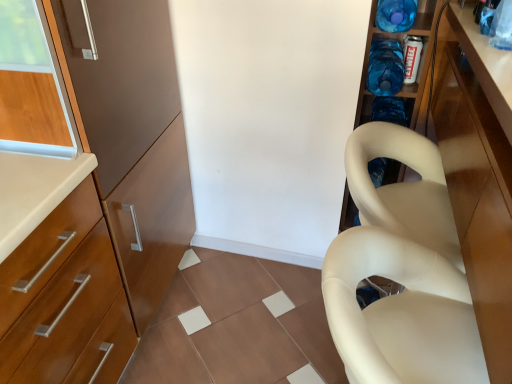
Question: Is the depth of beige matte plastic chair at right less than that of glossy wood cabinet at right?

Choices:
 (A) no
 (B) yes

Answer: (A)

Question: Is beige matte plastic chair at right behind glossy wood cabinet at right?

Choices:
 (A) yes
 (B) no

Answer: (A)

Question: Can you confirm if beige matte plastic chair at right is smaller than glossy wood cabinet at right?

Choices:
 (A) yes
 (B) no

Answer: (A)

Question: Could glossy wood cabinet at right be considered to be inside beige matte plastic chair at right?

Choices:
 (A) yes
 (B) no

Answer: (B)

Question: Is glossy wood cabinet at right at the back of beige matte plastic chair at right?

Choices:
 (A) no
 (B) yes

Answer: (A)

Question: Is beige matte plastic chair at right far away from glossy wood cabinet at right?

Choices:
 (A) yes
 (B) no

Answer: (B)

Question: Considering the relative sizes of blue plastic bottle at upper right, which ranks as the first bottle in bottom-to-top order, and blue translucent bottle at upper right, the second bottle ordered from the bottom, in the image provided, is blue plastic bottle at upper right, which ranks as the first bottle in bottom-to-top order, thinner than blue translucent bottle at upper right, the second bottle ordered from the bottom,?

Choices:
 (A) no
 (B) yes

Answer: (B)

Question: Could you tell me if blue plastic bottle at upper right, the 2th bottle positioned from the top, is turned towards blue translucent bottle at upper right, the second bottle ordered from the bottom?

Choices:
 (A) yes
 (B) no

Answer: (B)

Question: From a real-world perspective, does blue plastic bottle at upper right, the 2th bottle positioned from the top, sit lower than blue translucent bottle at upper right, which is counted as the 1th bottle, starting from the top?

Choices:
 (A) no
 (B) yes

Answer: (B)

Question: From a real-world perspective, is blue plastic bottle at upper right, which ranks as the first bottle in bottom-to-top order, on top of blue translucent bottle at upper right, the second bottle ordered from the bottom?

Choices:
 (A) yes
 (B) no

Answer: (B)

Question: From the image's perspective, is blue plastic bottle at upper right, which ranks as the first bottle in bottom-to-top order, on blue translucent bottle at upper right, the second bottle ordered from the bottom?

Choices:
 (A) no
 (B) yes

Answer: (A)

Question: Considering the relative sizes of blue plastic bottle at upper right, the 2th bottle positioned from the top, and blue translucent bottle at upper right, which is counted as the 1th bottle, starting from the top, in the image provided, is blue plastic bottle at upper right, the 2th bottle positioned from the top, taller than blue translucent bottle at upper right, which is counted as the 1th bottle, starting from the top,?

Choices:
 (A) no
 (B) yes

Answer: (B)

Question: From a real-world perspective, does blue plastic bottle at upper right, the 2th bottle positioned from the top, stand above glossy wood cabinet at right?

Choices:
 (A) yes
 (B) no

Answer: (A)